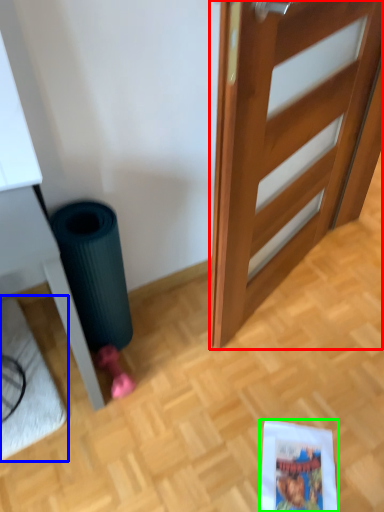
Question: Considering the real-world distances, which object is farthest from door (highlighted by a red box)? doormat (highlighted by a blue box) or comic book (highlighted by a green box)?

Choices:
 (A) doormat
 (B) comic book

Answer: (A)